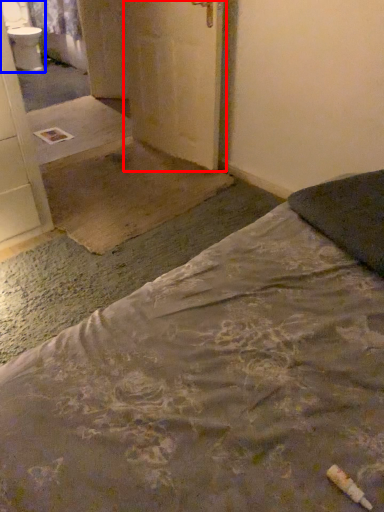
Question: Which object is closer to the camera taking this photo, door (highlighted by a red box) or sink (highlighted by a blue box)?

Choices:
 (A) door
 (B) sink

Answer: (A)